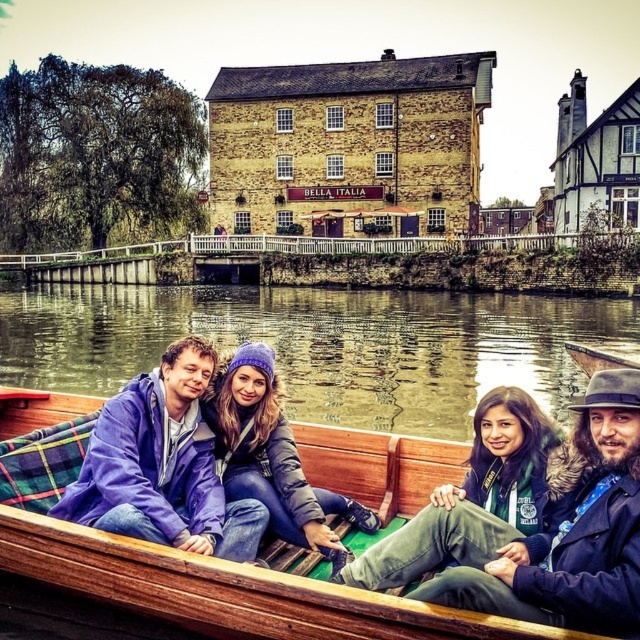
Does greenish-brown water at center have a larger size compared to green matte jacket at lower right?

Yes.

The width and height of the screenshot is (640, 640). Describe the element at coordinates (323, 346) in the screenshot. I see `greenish-brown water at center` at that location.

Is point (392, 321) farther from camera compared to point (525, 500)?

Yes, it is.

Find the location of `greenish-brown water at center`. greenish-brown water at center is located at coordinates (323, 346).

The width and height of the screenshot is (640, 640). I want to click on matte purple beanie at center, so click(x=269, y=454).

Looking at this image, does matte purple beanie at center have a greater width compared to green matte jacket at lower right?

In fact, matte purple beanie at center might be narrower than green matte jacket at lower right.

Which is behind, point (234, 490) or point (509, 419)?

Positioned behind is point (234, 490).

Where is `matte purple beanie at center`? This screenshot has height=640, width=640. matte purple beanie at center is located at coordinates (269, 454).

Is wooden boat at center in front of green matte jacket at lower right?

That is True.

Is point (13, 426) positioned after point (348, 561)?

That is True.

Is point (381, 628) closer to viewer compared to point (502, 490)?

Yes.

Where is `wooden boat at center`? wooden boat at center is located at coordinates (228, 589).